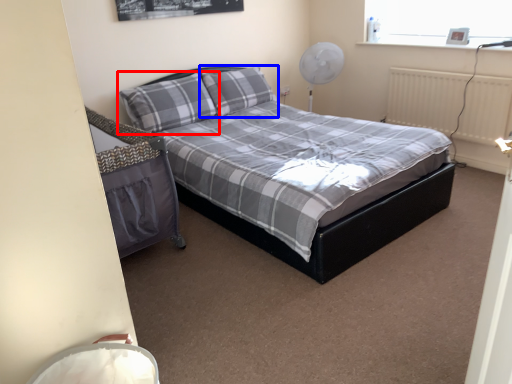
Question: Which point is closer to the camera, pillow (highlighted by a red box) or pillow (highlighted by a blue box)?

Choices:
 (A) pillow
 (B) pillow

Answer: (A)